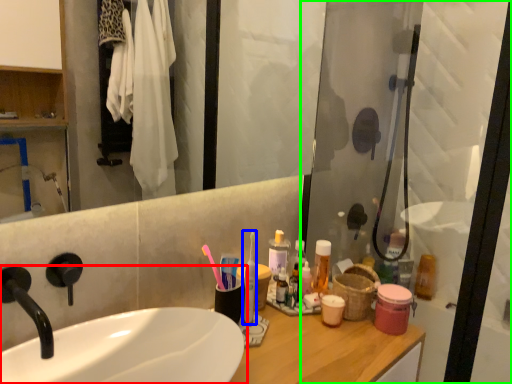
Question: Which is farther away from sink (highlighted by a red box)? toothbrush (highlighted by a blue box) or screen door (highlighted by a green box)?

Choices:
 (A) toothbrush
 (B) screen door

Answer: (B)